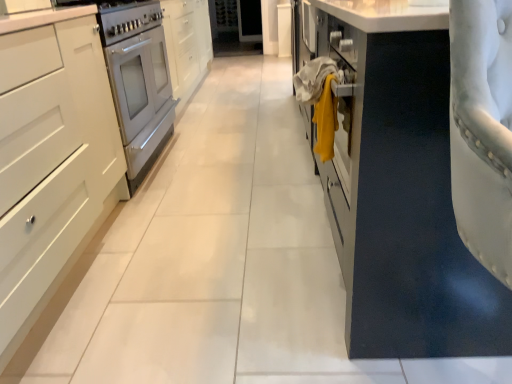
Question: Visually, is white glossy oven at left positioned to the left or to the right of white matte cabinet at left, which is the 1th cabinetry in left-to-right order?

Choices:
 (A) left
 (B) right

Answer: (B)

Question: Considering the positions of white glossy oven at left and white matte cabinet at left, the second cabinetry viewed from the right, in the image, is white glossy oven at left wider or thinner than white matte cabinet at left, the second cabinetry viewed from the right,?

Choices:
 (A) wide
 (B) thin

Answer: (B)

Question: Estimate the real-world distances between objects in this image. Which object is farther from the yellow fabric at center?

Choices:
 (A) white matte cabinet at left, which is the 1th cabinetry in left-to-right order
 (B) suede-like white chair at right, positioned as the second cabinetry in left-to-right order
 (C) white glossy oven at left

Answer: (C)

Question: Considering the real-world distances, which object is farthest from the white glossy oven at left?

Choices:
 (A) white matte cabinet at left, the second cabinetry viewed from the right
 (B) suede-like white chair at right, positioned as the second cabinetry in left-to-right order
 (C) yellow fabric at center

Answer: (B)